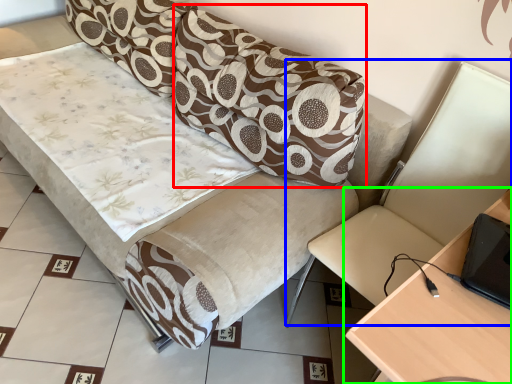
Question: Estimate the real-world distances between objects in this image. Which object is farther from pillow (highlighted by a red box), swivel chair (highlighted by a blue box) or table (highlighted by a green box)?

Choices:
 (A) swivel chair
 (B) table

Answer: (B)